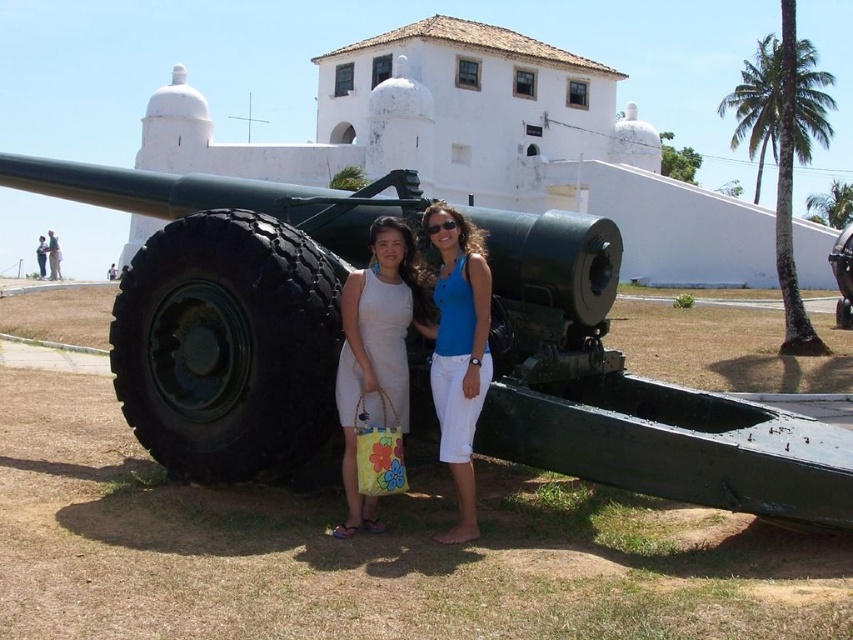
Question: Does white fabric dress at center have a larger size compared to blue cotton tank top at center?

Choices:
 (A) yes
 (B) no

Answer: (A)

Question: Which point is closer to the camera?

Choices:
 (A) (477, 356)
 (B) (801, 147)
 (C) (287, 211)
 (D) (354, 518)

Answer: (D)

Question: Among these points, which one is farthest from the camera?

Choices:
 (A) (784, 141)
 (B) (160, 449)

Answer: (A)

Question: Is green matte cannon at center positioned in front of white fabric dress at center?

Choices:
 (A) no
 (B) yes

Answer: (B)

Question: Is green matte cannon at center thinner than white fabric dress at center?

Choices:
 (A) yes
 (B) no

Answer: (B)

Question: Among these points, which one is farthest from the camera?

Choices:
 (A) click(x=368, y=348)
 (B) click(x=486, y=348)

Answer: (A)